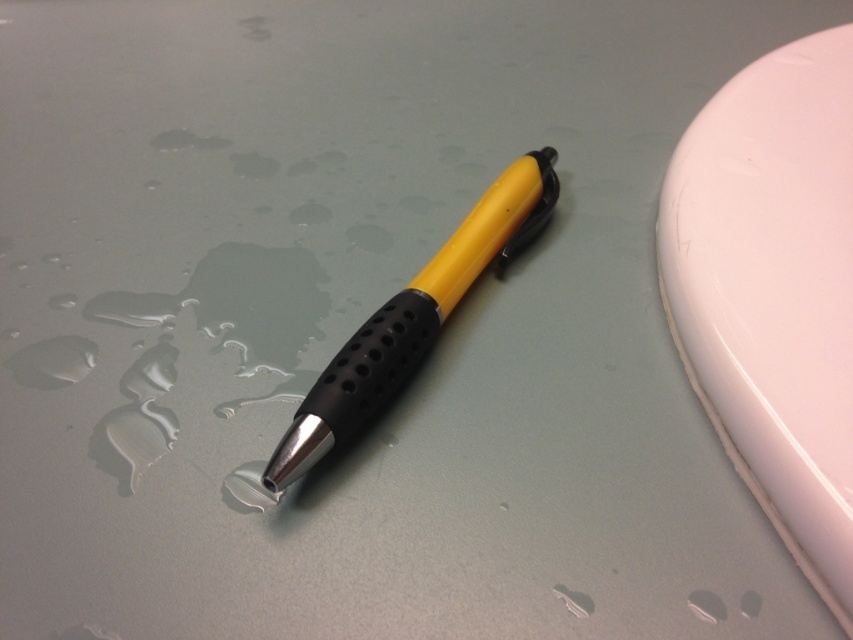
You are holding a measuring tape and need to determine if a 3.5 feet tall object can fit in front of point (805, 346) without exceeding the available space. Based on the image, what is your conclusion?

The distance of point (805, 346) from viewer is 4.04 feet. Since the object is 3.5 feet tall, it can fit in front of point (805, 346) as the available space is sufficient.

You are organizing a desk and need to place the white glossy eraser at upper right and the yellow matte pen at center. According to the image, which object is located higher up in the frame?

The white glossy eraser at upper right is positioned over the yellow matte pen at center, so it is higher up in the frame.

You are an artist working on a detailed drawing and need to locate your white glossy eraser at upper right. Based on the scene description, where would you look first to find it?

The white glossy eraser at upper right is located at point (x=773, y=291), so you should look there first.